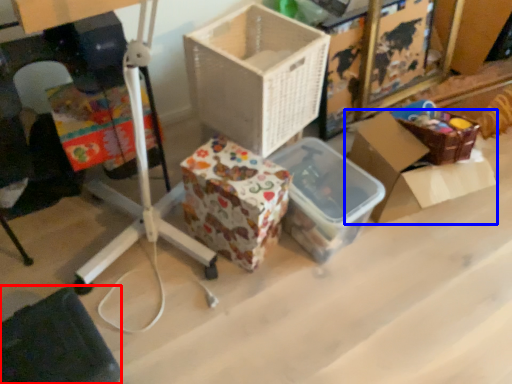
Question: Which object is closer to the camera taking this photo, wide (highlighted by a red box) or box (highlighted by a blue box)?

Choices:
 (A) wide
 (B) box

Answer: (A)